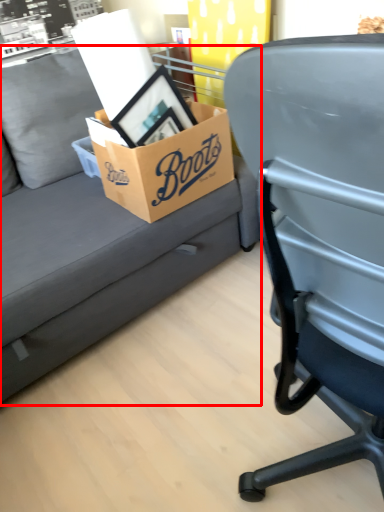
Question: Considering the relative positions of studio couch (annotated by the red box) and box in the image provided, where is studio couch (annotated by the red box) located with respect to the staircase?

Choices:
 (A) right
 (B) left

Answer: (B)